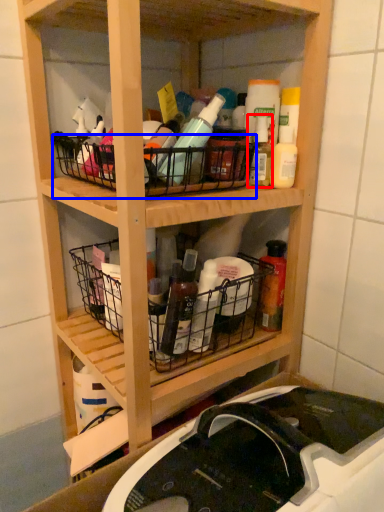
Question: Among these objects, which one is nearest to the camera, bottle (highlighted by a red box) or basket (highlighted by a blue box)?

Choices:
 (A) bottle
 (B) basket

Answer: (B)